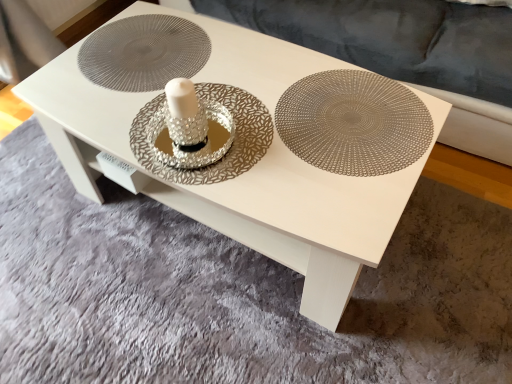
Question: Is metallic silver doily at center bigger than metallic silver plate at center?

Choices:
 (A) no
 (B) yes

Answer: (B)

Question: Is metallic silver doily at center facing towards metallic silver plate at center?

Choices:
 (A) no
 (B) yes

Answer: (A)

Question: From a real-world perspective, is metallic silver doily at center under metallic silver plate at center?

Choices:
 (A) yes
 (B) no

Answer: (A)

Question: Is metallic silver doily at center behind metallic silver plate at center?

Choices:
 (A) no
 (B) yes

Answer: (B)

Question: Is metallic silver doily at center far away from metallic silver plate at center?

Choices:
 (A) no
 (B) yes

Answer: (A)

Question: Is metallic silver doily at center in front of or behind velvet grey couch at upper center in the image?

Choices:
 (A) front
 (B) behind

Answer: (B)

Question: Is point (148, 48) closer or farther from the camera than point (470, 39)?

Choices:
 (A) closer
 (B) farther

Answer: (A)

Question: From the image's perspective, is metallic silver doily at center positioned above or below velvet grey couch at upper center?

Choices:
 (A) above
 (B) below

Answer: (B)

Question: In terms of width, does metallic silver doily at center look wider or thinner when compared to velvet grey couch at upper center?

Choices:
 (A) wide
 (B) thin

Answer: (B)

Question: Considering their positions, is velvet grey couch at upper center located in front of or behind metallic silver doily at center?

Choices:
 (A) behind
 (B) front

Answer: (B)

Question: From the image's perspective, is velvet grey couch at upper center positioned above or below metallic silver doily at center?

Choices:
 (A) below
 (B) above

Answer: (B)

Question: Based on their sizes in the image, would you say velvet grey couch at upper center is bigger or smaller than metallic silver doily at center?

Choices:
 (A) small
 (B) big

Answer: (B)

Question: Would you say velvet grey couch at upper center is inside or outside metallic silver doily at center?

Choices:
 (A) inside
 (B) outside

Answer: (B)

Question: From a real-world perspective, relative to metallic silver plate at center, is metallic silver doily at center vertically above or below?

Choices:
 (A) below
 (B) above

Answer: (A)

Question: Considering the positions of metallic silver doily at center and metallic silver plate at center in the image, is metallic silver doily at center bigger or smaller than metallic silver plate at center?

Choices:
 (A) small
 (B) big

Answer: (B)